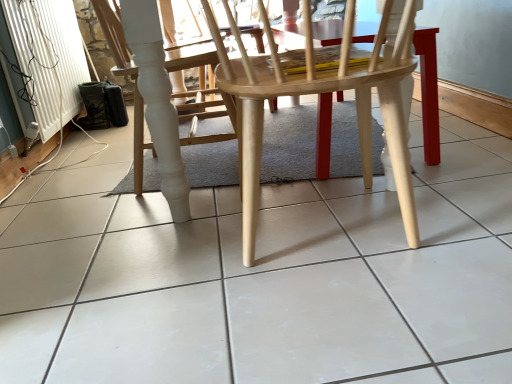
This screenshot has height=384, width=512. What are the coordinates of `free region under natural wood chair at center, the second chair when ordered from left to right (from a real-world perspective)` in the screenshot? It's located at (331, 238).